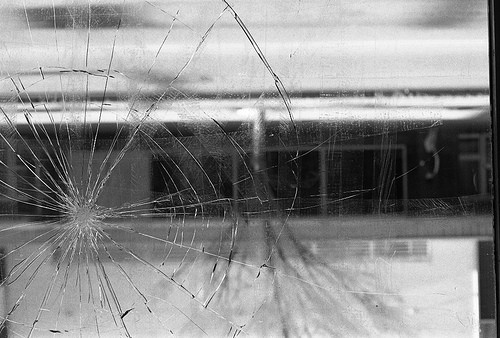
Locate an element on the screen. glass is located at coordinates (395, 195), (185, 94), (127, 254), (386, 69).